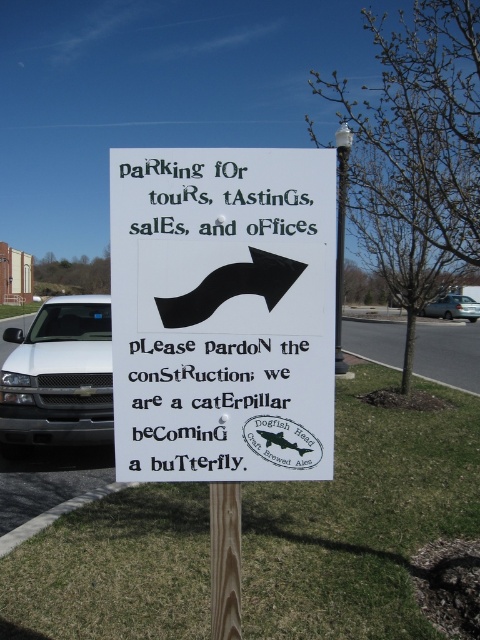
Is white matte truck at left below black paper sign at center?

Yes.

Does point (82, 358) lie behind point (178, 432)?

Yes, it is behind point (178, 432).

This screenshot has width=480, height=640. I want to click on white matte truck at left, so click(x=59, y=376).

Is wooden post at center above black paper sign at center?

No.

At what (x,y) coordinates should I click in order to perform the action: click on wooden post at center. Please return your answer as a coordinate pair (x, y). Looking at the image, I should click on (225, 560).

Locate an element on the screen. This screenshot has height=640, width=480. wooden post at center is located at coordinates (225, 560).

This screenshot has height=640, width=480. What are the coordinates of `wooden post at center` in the screenshot? It's located at (225, 560).

Does point (312, 198) come in front of point (240, 557)?

Yes, point (312, 198) is closer to viewer.

Between point (232, 198) and point (229, 525), which one is positioned in front?

Positioned in front is point (232, 198).

You are a GUI agent. You are given a task and a screenshot of the screen. Output one action in this format:
    pyautogui.click(x=<x>, y=<y>)
    Task: Click on the black text at upper center
    
    Given the screenshot: What is the action you would take?
    pyautogui.click(x=214, y=188)